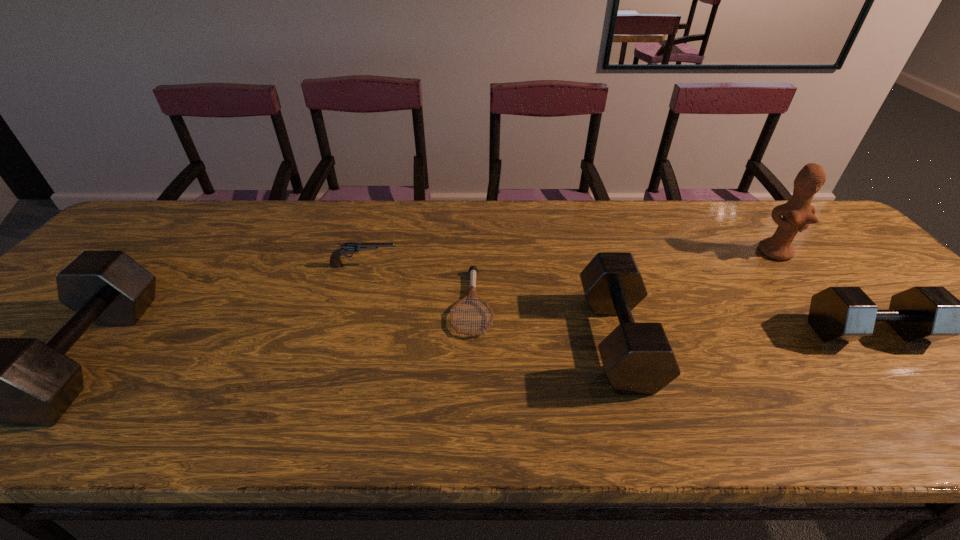
Locate an element on the screen. vacant space located on the back of the fourth shortest object is located at coordinates (593, 260).

Image resolution: width=960 pixels, height=540 pixels. In order to click on vacant position located 0.260m on the back of the rightmost dumbbell in this screenshot , I will do `click(795, 248)`.

Where is `free space located on the front-facing side of the tallest object`? free space located on the front-facing side of the tallest object is located at coordinates (800, 281).

The height and width of the screenshot is (540, 960). In order to click on vacant area located 0.220m aiming along the barrel of the gun in this screenshot , I will do `click(478, 266)`.

Find the location of `free space located on the left of the shortest object`. free space located on the left of the shortest object is located at coordinates (354, 303).

Image resolution: width=960 pixels, height=540 pixels. Identify the location of object present at the far edge. (798, 213).

Image resolution: width=960 pixels, height=540 pixels. I want to click on object located at the near edge, so click(x=638, y=359).

The width and height of the screenshot is (960, 540). Find the location of `object present at the right edge`. object present at the right edge is located at coordinates (838, 313).

Locate an element on the screen. This screenshot has width=960, height=540. free space at the far edge of the desktop is located at coordinates (243, 232).

The height and width of the screenshot is (540, 960). I want to click on vacant area at the near edge, so click(792, 368).